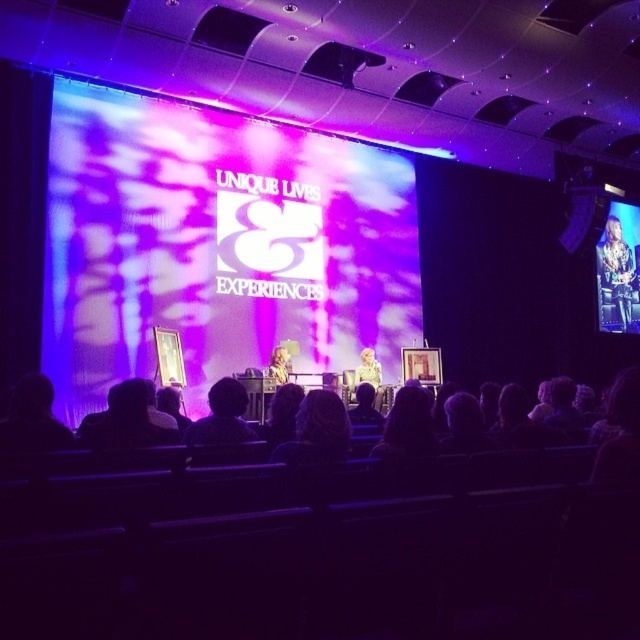
Question: Is light brown leather jacket at right smaller than blonde hair at center?

Choices:
 (A) yes
 (B) no

Answer: (B)

Question: Considering the real-world distances, which object is closest to the blonde hair at center?

Choices:
 (A) matte purple fabric at center
 (B) light brown leather jacket at right

Answer: (A)

Question: Does matte purple fabric at center lie in front of dark hair at center?

Choices:
 (A) no
 (B) yes

Answer: (A)

Question: Which object is the farthest from the matte purple fabric at center?

Choices:
 (A) blonde hair at center
 (B) dark hair at center

Answer: (B)

Question: Can you confirm if light brown leather jacket at right is wider than blonde hair at center?

Choices:
 (A) no
 (B) yes

Answer: (B)

Question: Based on their relative distances, which object is farther from the blonde hair at center?

Choices:
 (A) dark hair at center
 (B) matte purple fabric at center

Answer: (A)